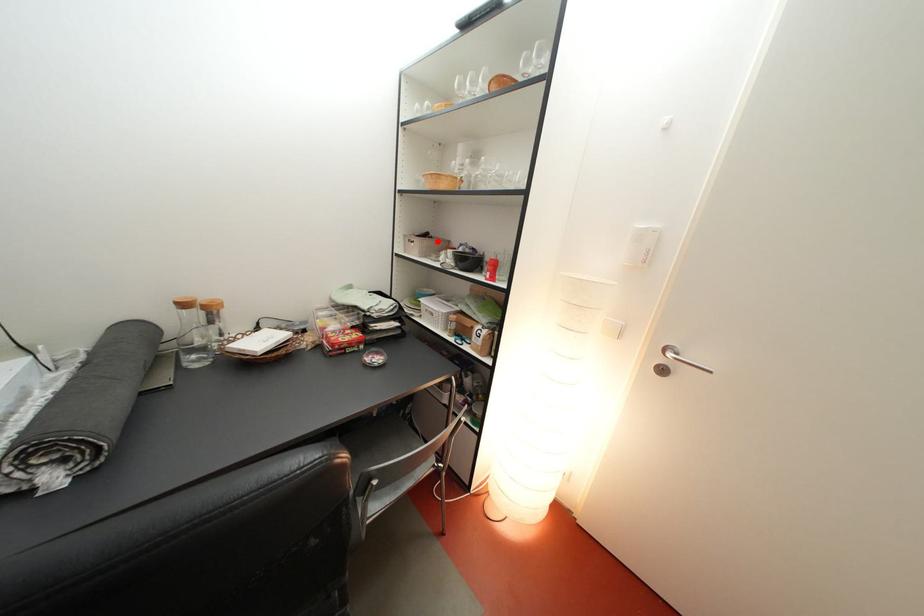
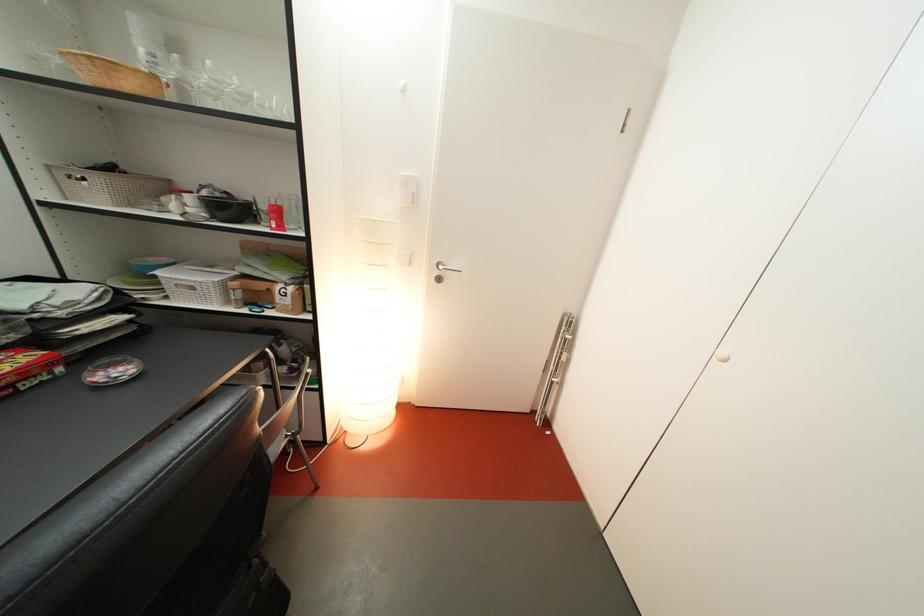
In the second image, find the point that corresponds to the highlighted location in the first image.

(122, 175)